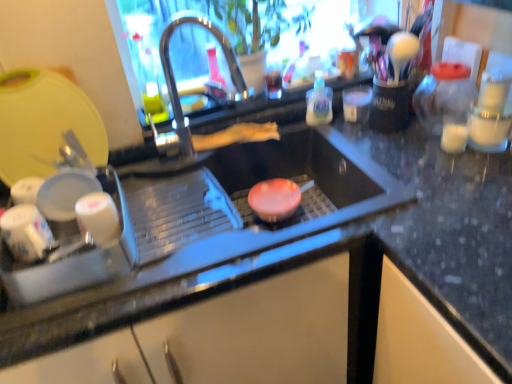
Image resolution: width=512 pixels, height=384 pixels. What do you see at coordinates (73, 253) in the screenshot?
I see `white glossy cups at left, the 1th appliance in the bottom-to-top sequence` at bounding box center [73, 253].

Locate an element on the screen. This screenshot has width=512, height=384. yellow plastic cutting board at upper left, the 2th appliance from the bottom is located at coordinates (44, 123).

Consider the image. Does translucent plastic bottle at upper right have a lesser width compared to white glossy cups at left, the 1th appliance in the bottom-to-top sequence?

Correct, the width of translucent plastic bottle at upper right is less than that of white glossy cups at left, the 1th appliance in the bottom-to-top sequence.

Can you tell me how much translucent plastic bottle at upper right and white glossy cups at left, which is the second appliance in top-to-bottom order, differ in facing direction?

They differ by 1.35 degrees in their facing directions.

Can you confirm if translucent plastic bottle at upper right is shorter than white glossy cups at left, which is the second appliance in top-to-bottom order?

In fact, translucent plastic bottle at upper right may be taller than white glossy cups at left, which is the second appliance in top-to-bottom order.

Who is bigger, translucent plastic bottle at upper right or white glossy cups at left, the 1th appliance in the bottom-to-top sequence?

white glossy cups at left, the 1th appliance in the bottom-to-top sequence, is bigger.

What's the angular difference between translucent plastic bottle at upper right and yellow plastic cutting board at upper left, the 2th appliance from the bottom,'s facing directions?

The facing directions of translucent plastic bottle at upper right and yellow plastic cutting board at upper left, the 2th appliance from the bottom, are 1.35 degrees apart.

There is a translucent plastic bottle at upper right. Where is `appliance above it (from a real-world perspective)`? appliance above it (from a real-world perspective) is located at coordinates (44, 123).

Can you confirm if translucent plastic bottle at upper right is thinner than yellow plastic cutting board at upper left, the 2th appliance from the bottom?

In fact, translucent plastic bottle at upper right might be wider than yellow plastic cutting board at upper left, the 2th appliance from the bottom.

Is yellow plastic cutting board at upper left, which is the 1th appliance in top-to-bottom order, located within translucent plastic bottle at upper right?

Actually, yellow plastic cutting board at upper left, which is the 1th appliance in top-to-bottom order, is outside translucent plastic bottle at upper right.

Could you measure the distance between polished stainless steel tap at center and white glossy cups at left, which is the second appliance in top-to-bottom order?

The distance of polished stainless steel tap at center from white glossy cups at left, which is the second appliance in top-to-bottom order, is 15.26 inches.

Is white glossy cups at left, the 1th appliance in the bottom-to-top sequence, at the back of polished stainless steel tap at center?

polished stainless steel tap at center is not turned away from white glossy cups at left, the 1th appliance in the bottom-to-top sequence.

Is the position of polished stainless steel tap at center less distant than that of white glossy cups at left, which is the second appliance in top-to-bottom order?

No.

Where is `appliance below the yellow plastic cutting board at upper left, which is the 1th appliance in top-to-bottom order (from the image's perspective)`? Image resolution: width=512 pixels, height=384 pixels. appliance below the yellow plastic cutting board at upper left, which is the 1th appliance in top-to-bottom order (from the image's perspective) is located at coordinates (73, 253).

Considering the positions of objects yellow plastic cutting board at upper left, the 2th appliance from the bottom, and white glossy cups at left, which is the second appliance in top-to-bottom order, in the image provided, who is in front, yellow plastic cutting board at upper left, the 2th appliance from the bottom, or white glossy cups at left, which is the second appliance in top-to-bottom order,?

Positioned in front is white glossy cups at left, which is the second appliance in top-to-bottom order.

What's the angular difference between yellow plastic cutting board at upper left, which is the 1th appliance in top-to-bottom order, and white glossy cups at left, which is the second appliance in top-to-bottom order,'s facing directions?

The facing directions of yellow plastic cutting board at upper left, which is the 1th appliance in top-to-bottom order, and white glossy cups at left, which is the second appliance in top-to-bottom order, are 0.00131 degrees apart.

Is white glossy cups at left, which is the second appliance in top-to-bottom order, positioned beyond the bounds of polished stainless steel tap at center?

Yes, white glossy cups at left, which is the second appliance in top-to-bottom order, is not within polished stainless steel tap at center.

Can you confirm if white glossy cups at left, which is the second appliance in top-to-bottom order, is bigger than polished stainless steel tap at center?

Incorrect, white glossy cups at left, which is the second appliance in top-to-bottom order, is not larger than polished stainless steel tap at center.

Is white glossy cups at left, the 1th appliance in the bottom-to-top sequence, oriented away from polished stainless steel tap at center?

No, polished stainless steel tap at center is not at the back of white glossy cups at left, the 1th appliance in the bottom-to-top sequence.

Between white glossy cups at left, the 1th appliance in the bottom-to-top sequence, and polished stainless steel tap at center, which one is positioned behind?

polished stainless steel tap at center is more distant.

Where is `the 2nd appliance to the left of the polished stainless steel tap at center, starting your count from the anchor`? The height and width of the screenshot is (384, 512). the 2nd appliance to the left of the polished stainless steel tap at center, starting your count from the anchor is located at coordinates (44, 123).

Is polished stainless steel tap at center further to the viewer compared to yellow plastic cutting board at upper left, which is the 1th appliance in top-to-bottom order?

Yes, polished stainless steel tap at center is behind yellow plastic cutting board at upper left, which is the 1th appliance in top-to-bottom order.

Considering the relative sizes of polished stainless steel tap at center and yellow plastic cutting board at upper left, the 2th appliance from the bottom, in the image provided, is polished stainless steel tap at center smaller than yellow plastic cutting board at upper left, the 2th appliance from the bottom,?

Incorrect, polished stainless steel tap at center is not smaller in size than yellow plastic cutting board at upper left, the 2th appliance from the bottom.

Measure the distance from polished stainless steel tap at center to yellow plastic cutting board at upper left, the 2th appliance from the bottom.

12.35 inches.

From the picture: Can you confirm if translucent plastic bottle at upper right is shorter than polished stainless steel tap at center?

Yes.

From the image's perspective, is translucent plastic bottle at upper right positioned above or below polished stainless steel tap at center?

translucent plastic bottle at upper right is situated higher than polished stainless steel tap at center in the image.

Considering the sizes of translucent plastic bottle at upper right and polished stainless steel tap at center in the image, is translucent plastic bottle at upper right wider or thinner than polished stainless steel tap at center?

Considering their sizes, translucent plastic bottle at upper right looks slimmer than polished stainless steel tap at center.

The height and width of the screenshot is (384, 512). I want to click on bottle lying on the right of white glossy cups at left, the 1th appliance in the bottom-to-top sequence, so click(x=319, y=102).

This screenshot has width=512, height=384. Find the location of `appliance above the translucent plastic bottle at upper right (from a real-world perspective)`. appliance above the translucent plastic bottle at upper right (from a real-world perspective) is located at coordinates (44, 123).

Considering their positions, is polished stainless steel tap at center positioned further to yellow plastic cutting board at upper left, which is the 1th appliance in top-to-bottom order, than white glossy cups at left, which is the second appliance in top-to-bottom order?

The object further to yellow plastic cutting board at upper left, which is the 1th appliance in top-to-bottom order, is polished stainless steel tap at center.

When comparing their distances from white glossy cups at left, the 1th appliance in the bottom-to-top sequence, does translucent plastic bottle at upper right or polished stainless steel tap at center seem closer?

polished stainless steel tap at center is closer to white glossy cups at left, the 1th appliance in the bottom-to-top sequence.

Estimate the real-world distances between objects in this image. Which object is closer to polished stainless steel tap at center, yellow plastic cutting board at upper left, the 2th appliance from the bottom, or white glossy cups at left, the 1th appliance in the bottom-to-top sequence?

Among the two, yellow plastic cutting board at upper left, the 2th appliance from the bottom, is located nearer to polished stainless steel tap at center.

Considering their positions, is polished stainless steel tap at center positioned further to white glossy cups at left, which is the second appliance in top-to-bottom order, than translucent plastic bottle at upper right?

translucent plastic bottle at upper right is further to white glossy cups at left, which is the second appliance in top-to-bottom order.

Consider the image. Based on their spatial positions, is yellow plastic cutting board at upper left, which is the 1th appliance in top-to-bottom order, or white glossy cups at left, the 1th appliance in the bottom-to-top sequence, further from translucent plastic bottle at upper right?

white glossy cups at left, the 1th appliance in the bottom-to-top sequence, is further to translucent plastic bottle at upper right.

From the picture: Based on their spatial positions, is yellow plastic cutting board at upper left, the 2th appliance from the bottom, or translucent plastic bottle at upper right closer to white glossy cups at left, the 1th appliance in the bottom-to-top sequence?

Among the two, yellow plastic cutting board at upper left, the 2th appliance from the bottom, is located nearer to white glossy cups at left, the 1th appliance in the bottom-to-top sequence.

Considering their positions, is yellow plastic cutting board at upper left, the 2th appliance from the bottom, positioned further to translucent plastic bottle at upper right than polished stainless steel tap at center?

yellow plastic cutting board at upper left, the 2th appliance from the bottom, lies further to translucent plastic bottle at upper right than the other object.

From the image, which object appears to be nearer to polished stainless steel tap at center, white glossy cups at left, the 1th appliance in the bottom-to-top sequence, or yellow plastic cutting board at upper left, which is the 1th appliance in top-to-bottom order?

Among the two, yellow plastic cutting board at upper left, which is the 1th appliance in top-to-bottom order, is located nearer to polished stainless steel tap at center.

Identify the location of tap located between yellow plastic cutting board at upper left, which is the 1th appliance in top-to-bottom order, and translucent plastic bottle at upper right in the left-right direction. Image resolution: width=512 pixels, height=384 pixels. (177, 91).

Identify the location of tap between white glossy cups at left, the 1th appliance in the bottom-to-top sequence, and translucent plastic bottle at upper right from left to right. The image size is (512, 384). [177, 91].

Identify the location of appliance between yellow plastic cutting board at upper left, the 2th appliance from the bottom, and translucent plastic bottle at upper right. (73, 253).

At what (x,y) coordinates should I click in order to perform the action: click on appliance between yellow plastic cutting board at upper left, which is the 1th appliance in top-to-bottom order, and polished stainless steel tap at center. Please return your answer as a coordinate pair (x, y). Image resolution: width=512 pixels, height=384 pixels. Looking at the image, I should click on (73, 253).